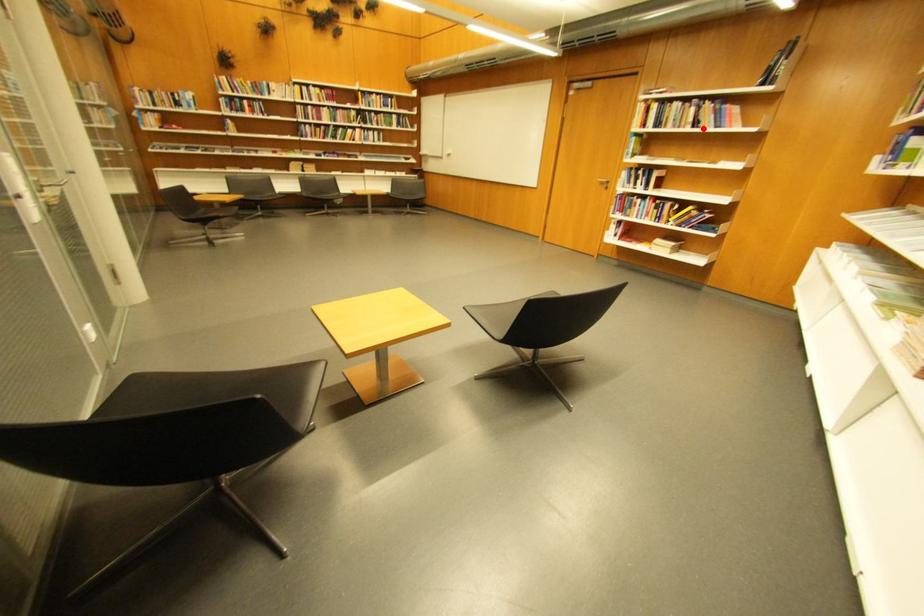
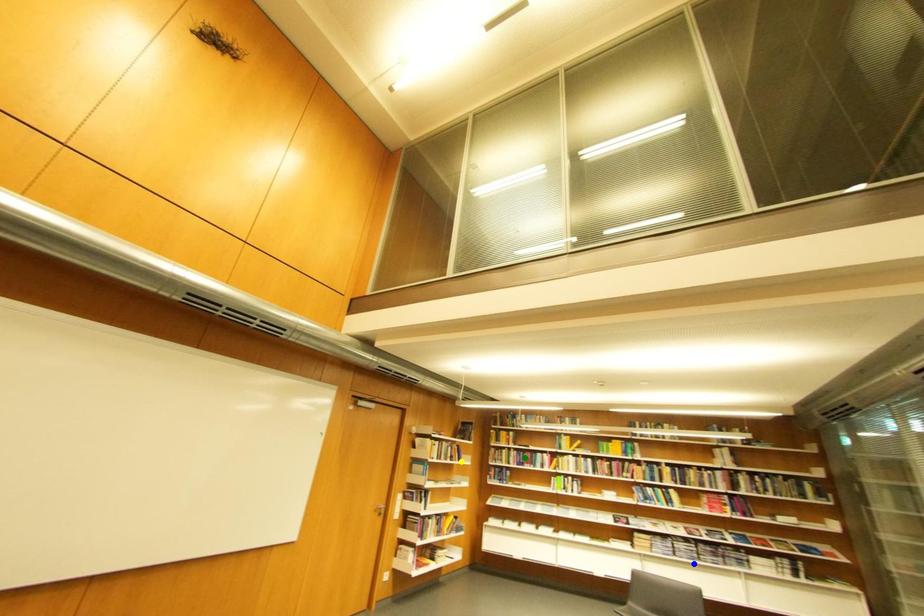
Question: I am providing you with two images of the same scene from different viewpoints. A red point is marked on the first image. You are given multiple points on the second image. Which mark in image 2 goes with the point in image 1?

Choices:
 (A) green point
 (B) blue point
 (C) yellow point

Answer: (C)